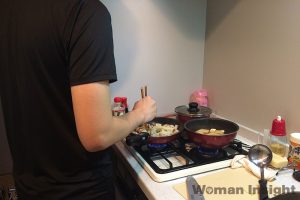
Image resolution: width=300 pixels, height=200 pixels. I want to click on cooking pots, so click(x=214, y=139), click(x=181, y=117).